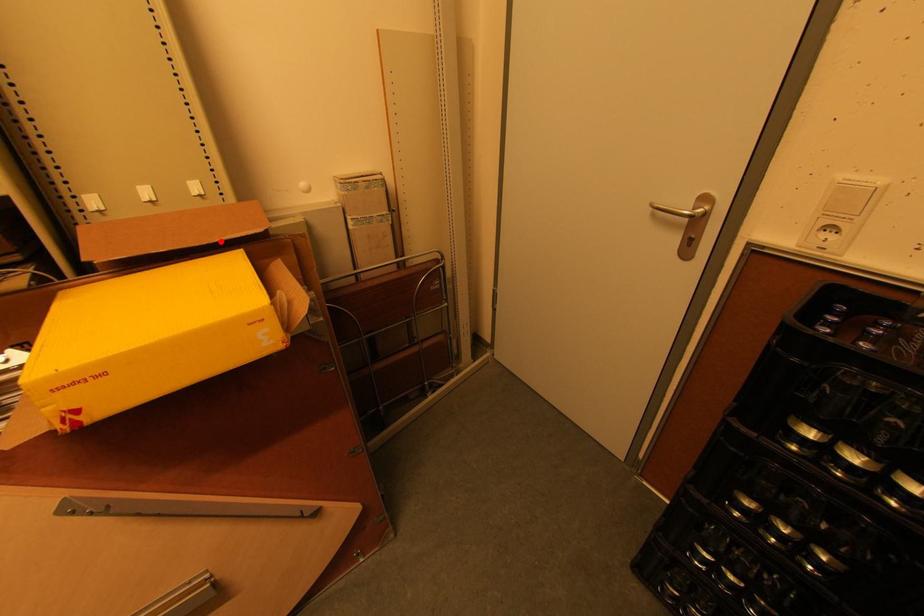
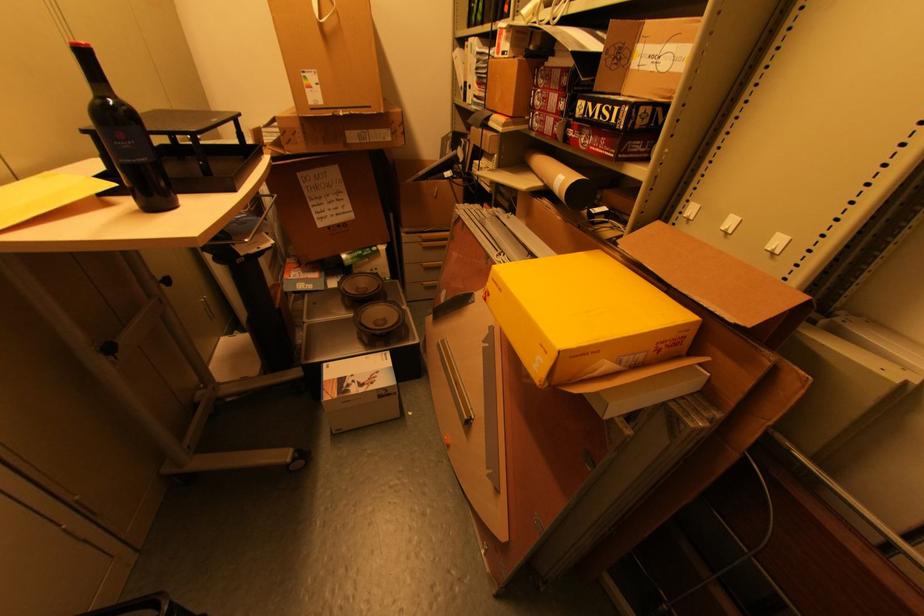
Locate, in the second image, the point that corresponds to the highlighted location in the first image.

(688, 294)